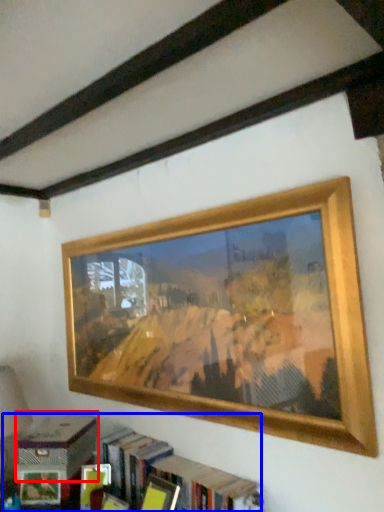
Question: Which object is further to the camera taking this photo, paperback book (highlighted by a red box) or bookcase (highlighted by a blue box)?

Choices:
 (A) paperback book
 (B) bookcase

Answer: (A)